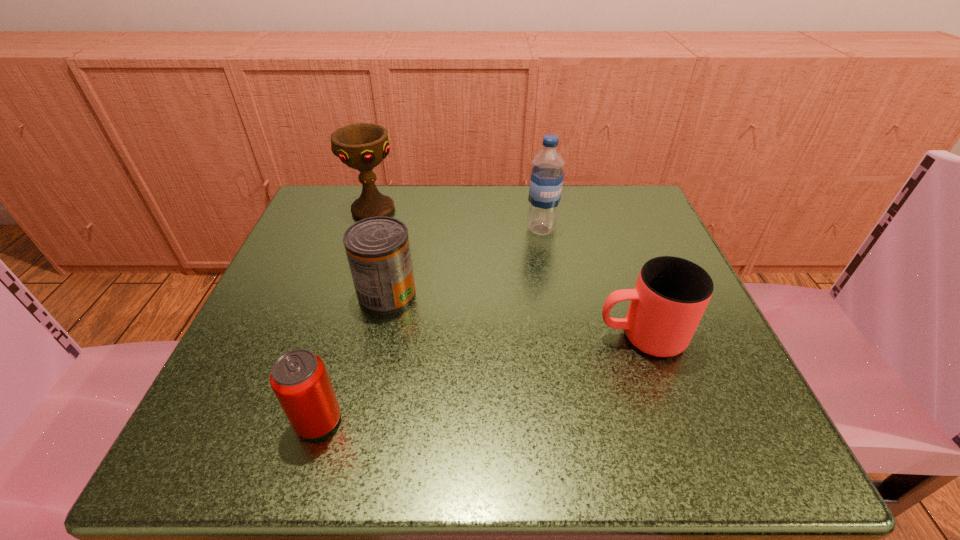
Image resolution: width=960 pixels, height=540 pixels. I want to click on water bottle, so click(547, 175).

This screenshot has height=540, width=960. I want to click on chalice, so click(362, 146).

Locate an element on the screen. the farther can is located at coordinates (378, 251).

Where is `cup`? The width and height of the screenshot is (960, 540). cup is located at coordinates (671, 294).

Locate an element on the screen. This screenshot has height=540, width=960. the nearest object is located at coordinates (299, 379).

Find the location of `vacant space located 0.070m on the label of the water bottle`. vacant space located 0.070m on the label of the water bottle is located at coordinates [546, 261].

What are the coordinates of `free location located 0.400m on the front of the chalice` in the screenshot? It's located at (317, 386).

What are the coordinates of `free spot located 0.150m on the right of the farther can` in the screenshot? It's located at (501, 295).

This screenshot has height=540, width=960. In order to click on vacant space situated on the handle side of the rightmost object in this screenshot , I will do `click(540, 336)`.

Find the location of `vacant space located 0.190m on the handle side of the rightmost object`. vacant space located 0.190m on the handle side of the rightmost object is located at coordinates (477, 336).